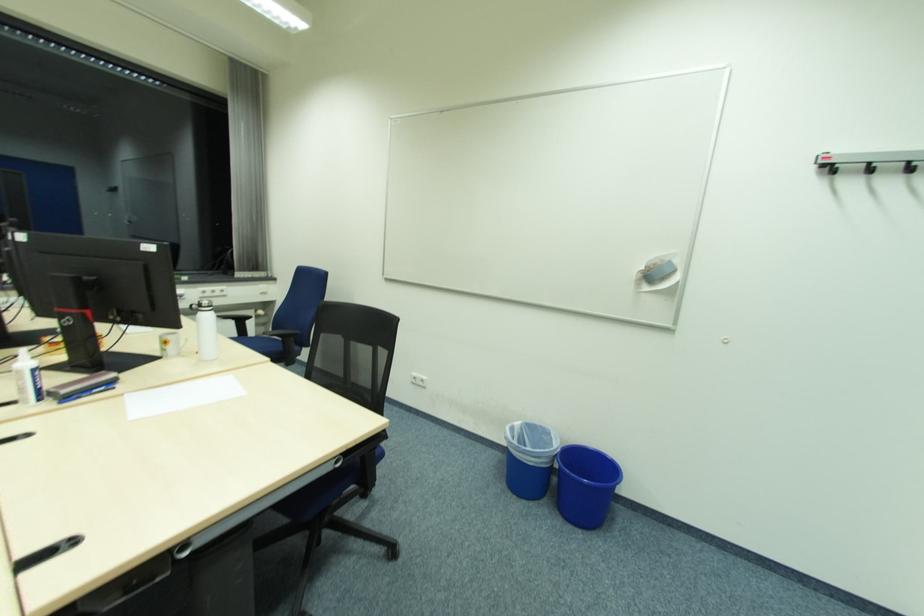
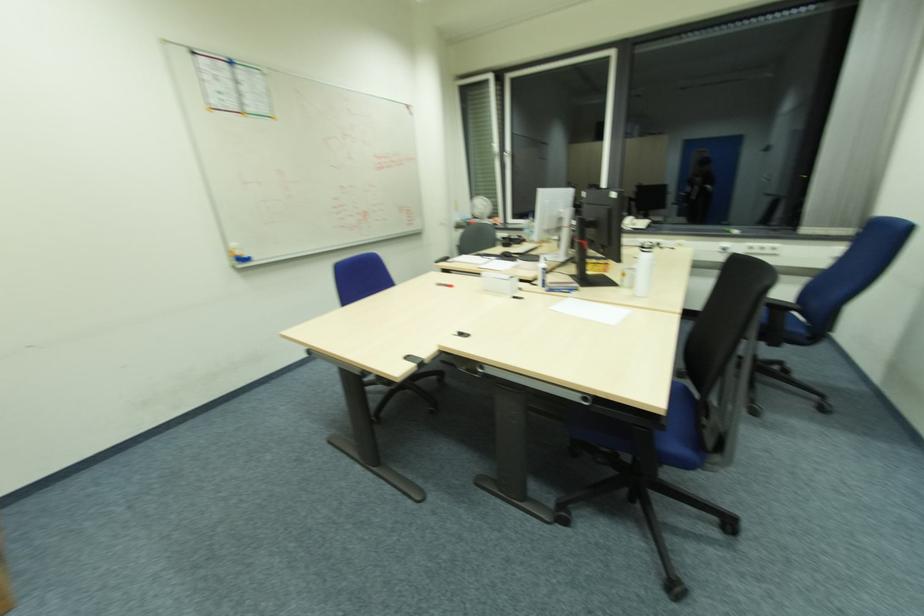
Question: The camera is either moving clockwise (left) or counter-clockwise (right) around the object. The first image is from the beginning of the video and the second image is from the end. Is the camera moving left or right when shooting the video?

Choices:
 (A) Left
 (B) Right

Answer: (B)